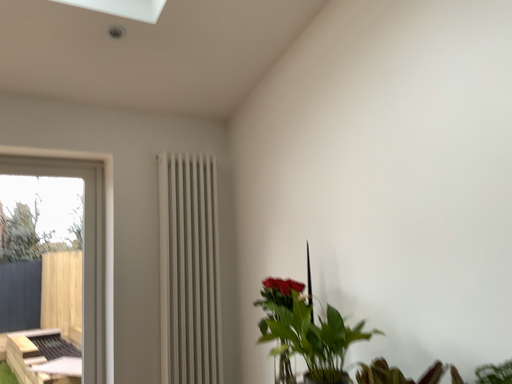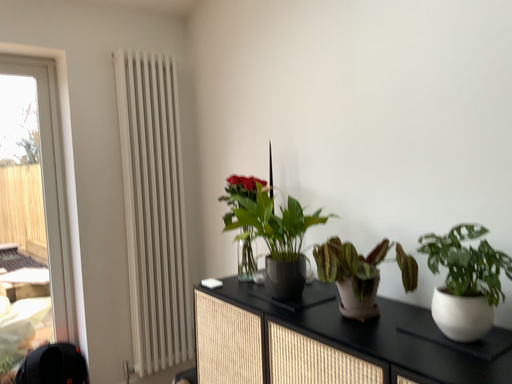
Question: Which way did the camera rotate in the video?

Choices:
 (A) rotated downward
 (B) rotated upward

Answer: (A)